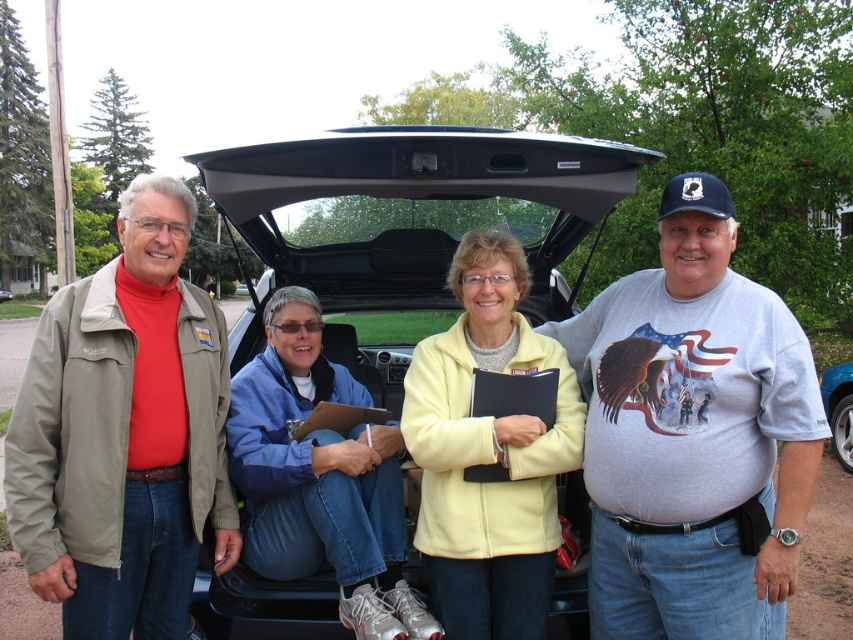
Is gray cotton t-shirt at center smaller than blue metallic car at lower right?

No.

Can you confirm if gray cotton t-shirt at center is bigger than blue metallic car at lower right?

Yes.

Is point (676, 305) in front of point (849, 452)?

That is True.

Where is `gray cotton t-shirt at center`? The height and width of the screenshot is (640, 853). gray cotton t-shirt at center is located at coordinates (x=693, y=435).

Is blue fleece jacket at center thinner than blue metallic car at lower right?

In fact, blue fleece jacket at center might be wider than blue metallic car at lower right.

Does blue fleece jacket at center appear under blue metallic car at lower right?

Incorrect, blue fleece jacket at center is not positioned below blue metallic car at lower right.

The width and height of the screenshot is (853, 640). Describe the element at coordinates (318, 476) in the screenshot. I see `blue fleece jacket at center` at that location.

The height and width of the screenshot is (640, 853). In order to click on blue fleece jacket at center in this screenshot , I will do `click(318, 476)`.

Who is lower down, matte khaki jacket at left or yellow fleece jacket at center?

matte khaki jacket at left

Consider the image. Is matte khaki jacket at left bigger than yellow fleece jacket at center?

Incorrect, matte khaki jacket at left is not larger than yellow fleece jacket at center.

Locate an element on the screen. The image size is (853, 640). matte khaki jacket at left is located at coordinates (125, 433).